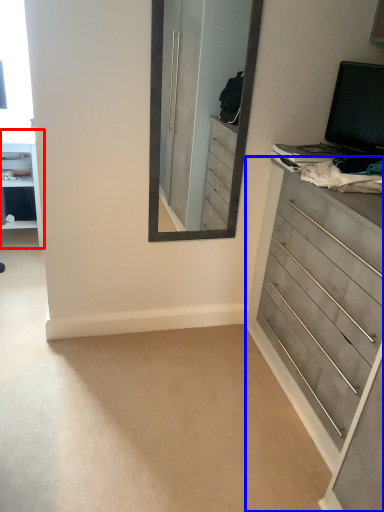
Question: Which object appears farthest to the camera in this image, vanity (highlighted by a red box) or chest of drawers (highlighted by a blue box)?

Choices:
 (A) vanity
 (B) chest of drawers

Answer: (A)